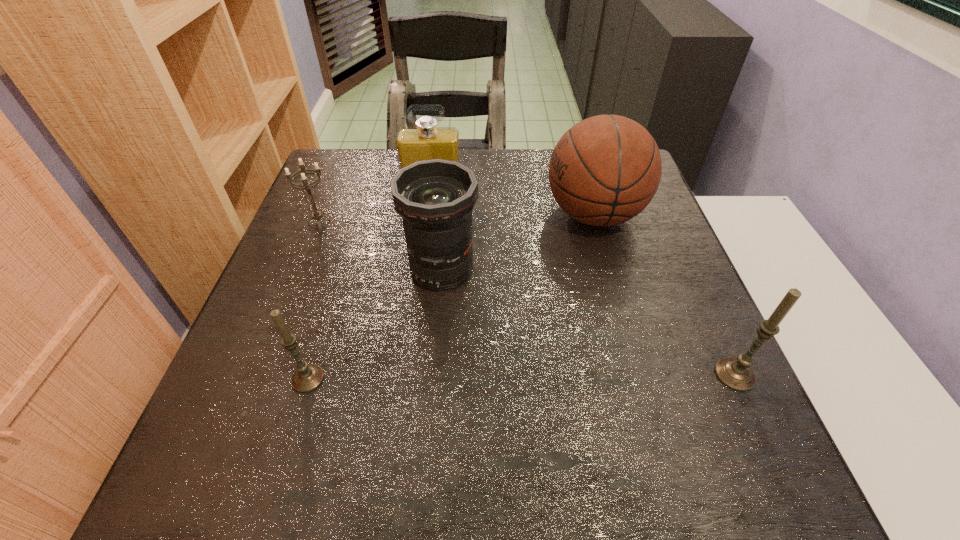
This screenshot has height=540, width=960. Identify the location of free space between the perfume and the right candle. (584, 282).

Find the location of a particular element. free space between the second object from right to left and the perfume is located at coordinates (513, 202).

This screenshot has width=960, height=540. In order to click on empty space that is in between the right candle and the left candle in this screenshot , I will do `click(521, 376)`.

Select which object is the fourth closest to the right candle. Please provide its 2D coordinates. Your answer should be formatted as a tuple, i.e. [(x, y)], where the tuple contains the x and y coordinates of a point satisfying the conditions above.

[(307, 377)]

Select which object appears as the second closest to the right candle. Please provide its 2D coordinates. Your answer should be formatted as a tuple, i.e. [(x, y)], where the tuple contains the x and y coordinates of a point satisfying the conditions above.

[(435, 198)]

The height and width of the screenshot is (540, 960). I want to click on vacant point that satisfies the following two spatial constraints: 1. on the side with brand label of the fifth object from left to right; 2. on the front side of the candle holder, so click(x=596, y=222).

Find the location of `free space in the image that satisfies the following two spatial constraints: 1. on the front-facing side of the perfume; 2. on the left side of the taller candle`. free space in the image that satisfies the following two spatial constraints: 1. on the front-facing side of the perfume; 2. on the left side of the taller candle is located at coordinates (409, 375).

At what (x,y) coordinates should I click in order to perform the action: click on vacant region that satisfies the following two spatial constraints: 1. on the front-facing side of the rightmost object; 2. on the right side of the perfume. Please return your answer as a coordinate pair (x, y). This screenshot has height=540, width=960. Looking at the image, I should click on (409, 375).

Where is `free location that satisfies the following two spatial constraints: 1. on the front-facing side of the taller candle; 2. on the right side of the perfume`? free location that satisfies the following two spatial constraints: 1. on the front-facing side of the taller candle; 2. on the right side of the perfume is located at coordinates (409, 375).

Image resolution: width=960 pixels, height=540 pixels. Identify the location of vacant point that satisfies the following two spatial constraints: 1. on the side with brand label of the fifth object from left to right; 2. on the front side of the second object from left to right. click(641, 379).